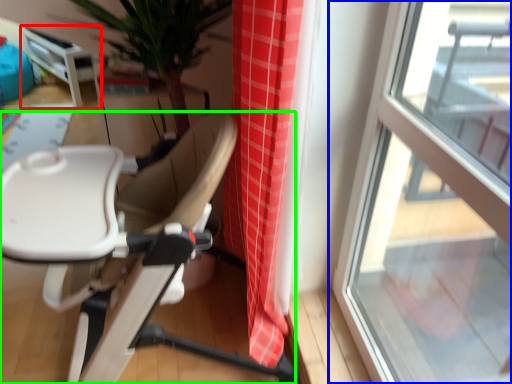
Question: Considering the real-world distances, which object is farthest from table (highlighted by a red box)? window (highlighted by a blue box) or chair (highlighted by a green box)?

Choices:
 (A) window
 (B) chair

Answer: (A)